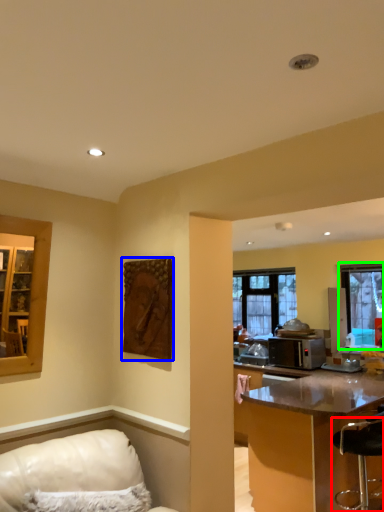
Question: Which is nearer to the bar stool (highlighted by a red box)? picture frame (highlighted by a blue box) or window (highlighted by a green box).

Choices:
 (A) picture frame
 (B) window

Answer: (B)